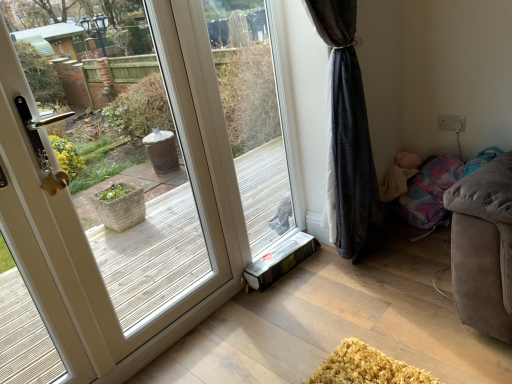
Question: Does soft beige blanket at lower right turn towards white glossy door at left?

Choices:
 (A) no
 (B) yes

Answer: (B)

Question: Considering the relative sizes of soft beige blanket at lower right and white glossy door at left in the image provided, is soft beige blanket at lower right taller than white glossy door at left?

Choices:
 (A) yes
 (B) no

Answer: (B)

Question: Can you confirm if soft beige blanket at lower right is shorter than white glossy door at left?

Choices:
 (A) no
 (B) yes

Answer: (B)

Question: Is soft beige blanket at lower right beside white glossy door at left?

Choices:
 (A) yes
 (B) no

Answer: (B)

Question: Is soft beige blanket at lower right wider than white glossy door at left?

Choices:
 (A) no
 (B) yes

Answer: (B)

Question: From their relative heights in the image, would you say transparent glass window at center is taller or shorter than soft beige blanket at lower right?

Choices:
 (A) tall
 (B) short

Answer: (A)

Question: Visually, is transparent glass window at center positioned to the left or to the right of soft beige blanket at lower right?

Choices:
 (A) left
 (B) right

Answer: (A)

Question: From a real-world perspective, relative to soft beige blanket at lower right, is transparent glass window at center vertically above or below?

Choices:
 (A) below
 (B) above

Answer: (B)

Question: Based on their sizes in the image, would you say transparent glass window at center is bigger or smaller than soft beige blanket at lower right?

Choices:
 (A) small
 (B) big

Answer: (B)

Question: Is transparent glass window at center taller or shorter than white glossy door at left?

Choices:
 (A) tall
 (B) short

Answer: (B)

Question: From the image's perspective, is transparent glass window at center above or below white glossy door at left?

Choices:
 (A) below
 (B) above

Answer: (B)

Question: In terms of size, does transparent glass window at center appear bigger or smaller than white glossy door at left?

Choices:
 (A) small
 (B) big

Answer: (A)

Question: Based on their positions, is transparent glass window at center located to the left or right of white glossy door at left?

Choices:
 (A) right
 (B) left

Answer: (A)

Question: Considering the relative positions of white glossy door at left and transparent glass window at center in the image provided, is white glossy door at left to the left or to the right of transparent glass window at center?

Choices:
 (A) left
 (B) right

Answer: (A)

Question: Looking at the image, does white glossy door at left seem bigger or smaller compared to transparent glass window at center?

Choices:
 (A) small
 (B) big

Answer: (B)